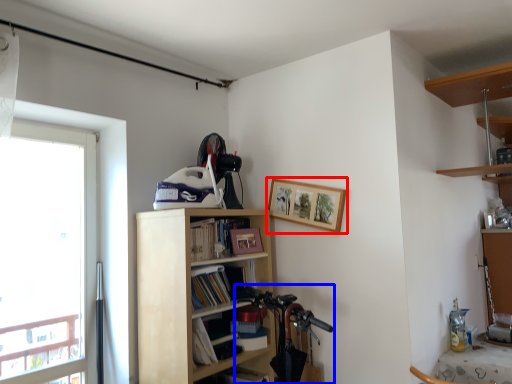
Question: Among these objects, which one is farthest to the camera, picture frame (highlighted by a red box) or mountain bike (highlighted by a blue box)?

Choices:
 (A) picture frame
 (B) mountain bike

Answer: (B)